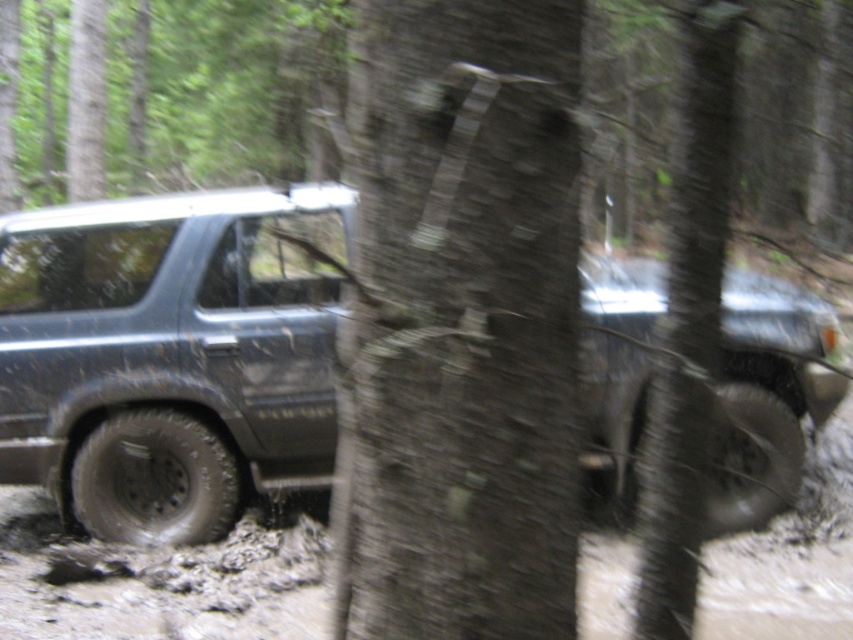
You are a hiker trying to navigate through the forest and see the muddy rubber jeep at center and the brown rough bark at center. Which object is higher up in the image?

The brown rough bark at center is higher up in the image because the muddy rubber jeep at center is located below it.

You are a hiker trying to identify landmarks in the forest. You see a point marked at coordinates (463, 326). What is the feature located at that point?

The point at coordinates (463, 326) corresponds to brown rough bark at center, which is part of the tree trunk obscuring the SUV in the image.